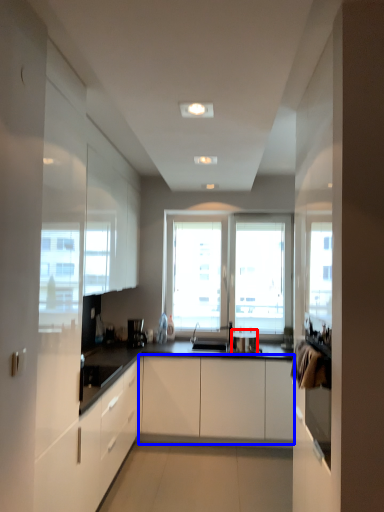
Question: Which of the following is the closest to the observer, appliance (highlighted by a red box) or cabinetry (highlighted by a blue box)?

Choices:
 (A) appliance
 (B) cabinetry

Answer: (B)